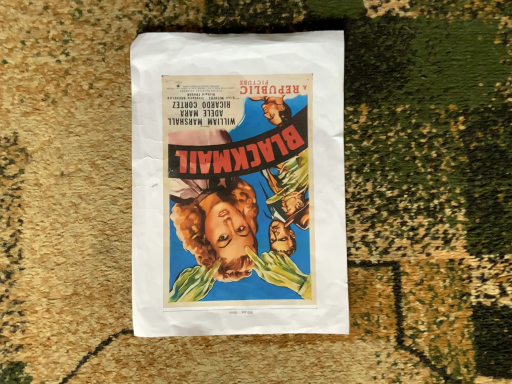
Find the location of `free location above vintage paper poster at center (from a real-world perspective)`. free location above vintage paper poster at center (from a real-world perspective) is located at coordinates (234, 183).